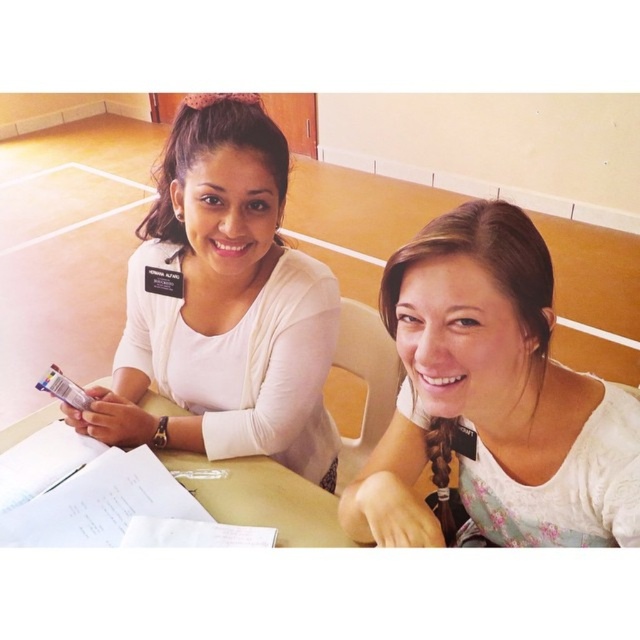
You are organizing a photoshoot and need to ensure that the white matte shirt at center and the light brown wooden table at center are visible in the frame. Given their sizes, which object should you prioritize positioning closer to the camera to ensure clarity?

The white matte shirt at center has a larger size compared to the light brown wooden table at center, so you should prioritize positioning the white matte shirt at center closer to the camera to ensure clarity.

You are organizing a photoshoot and need to arrange two models wearing different tops. The models are seated at a green table with papers and a pen. The tops are the white floral blouse at center and the white matte shirt at center. Based on the image, which top is positioned to the right of the other?

The white floral blouse at center is to the right of the white matte shirt at center.